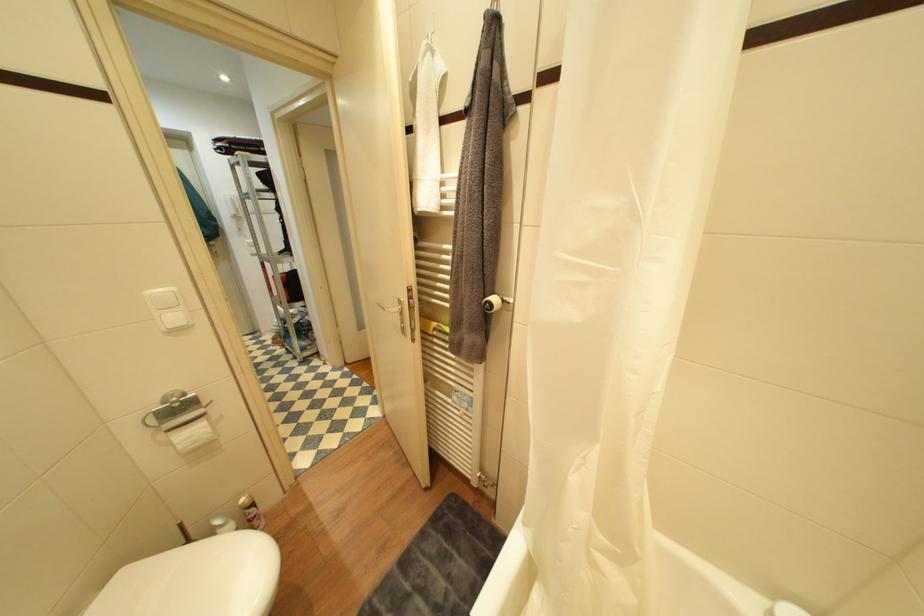
Describe the element at coordinates (398, 315) in the screenshot. This screenshot has width=924, height=616. I see `a silver door handle` at that location.